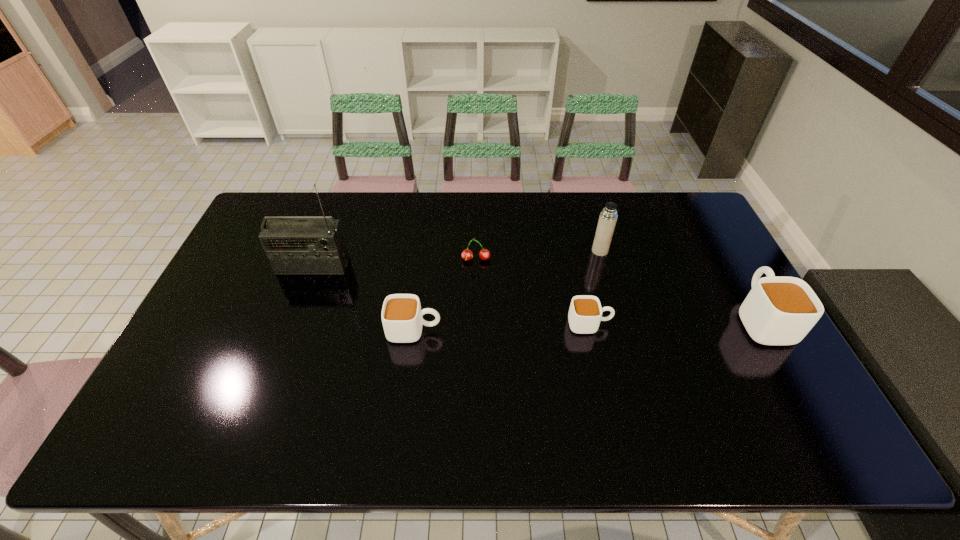
This screenshot has height=540, width=960. Find the location of `vacant space at the near edge`. vacant space at the near edge is located at coordinates (321, 392).

The image size is (960, 540). Find the location of `vacant space at the left edge of the desktop`. vacant space at the left edge of the desktop is located at coordinates (235, 350).

Image resolution: width=960 pixels, height=540 pixels. What are the coordinates of `free point at the right edge` in the screenshot? It's located at (745, 351).

Locate an element on the screen. Image resolution: width=960 pixels, height=540 pixels. free spot between the cherry and the thermos bottle is located at coordinates (538, 255).

Find the location of a particular element. empty location between the tallest object and the shortest cup is located at coordinates (451, 295).

The width and height of the screenshot is (960, 540). In order to click on free space that is in between the second tallest object and the third object from left to right in this screenshot , I will do coord(538,255).

The height and width of the screenshot is (540, 960). What are the coordinates of `vacant area that lies between the second tallest object and the cherry` in the screenshot? It's located at (538, 255).

Where is `free point between the cherry and the thermos bottle`? This screenshot has height=540, width=960. free point between the cherry and the thermos bottle is located at coordinates (538, 255).

Where is `vacant space in between the leftmost cup and the cherry`? The width and height of the screenshot is (960, 540). vacant space in between the leftmost cup and the cherry is located at coordinates (445, 295).

Where is `unoccupied position between the thermos bottle and the tallest object`? The width and height of the screenshot is (960, 540). unoccupied position between the thermos bottle and the tallest object is located at coordinates (456, 258).